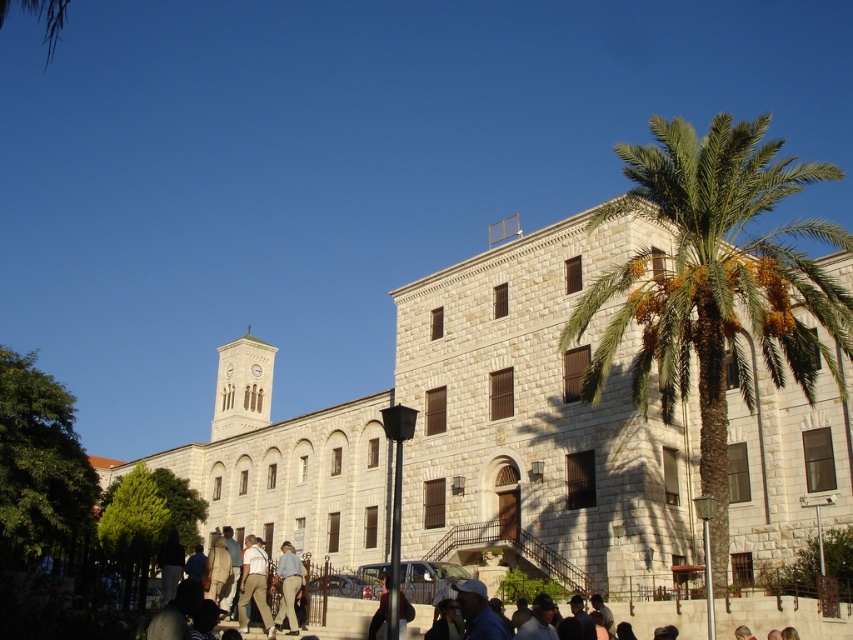
Question: Which point appears farthest from the camera in this image?

Choices:
 (A) (816, 273)
 (B) (556, 509)

Answer: (B)

Question: Is white stone church at center wider than green leafy palm at center?

Choices:
 (A) no
 (B) yes

Answer: (A)

Question: Is white stone church at center to the left of green leafy palm at center from the viewer's perspective?

Choices:
 (A) yes
 (B) no

Answer: (A)

Question: Can you confirm if white stone church at center is positioned above green leafy palm at center?

Choices:
 (A) no
 (B) yes

Answer: (A)